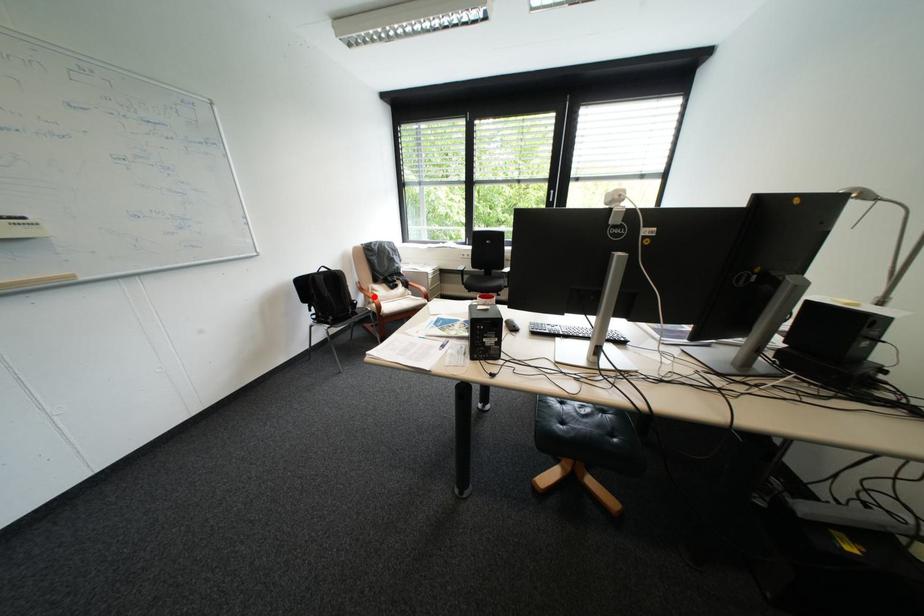
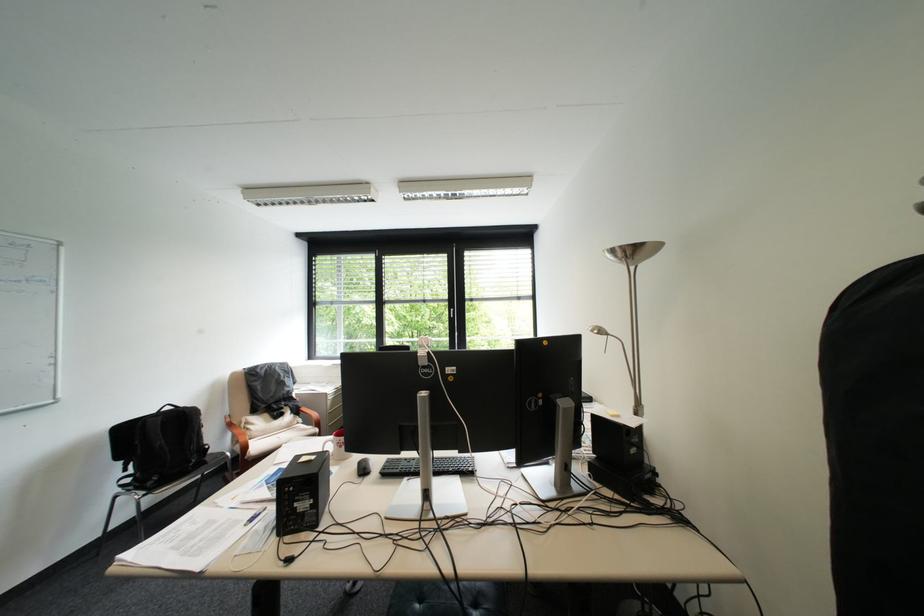
Question: I am providing you with two images of the same scene from different viewpoints. Given a red point in image1, look at the same physical point in image2. Is it:

Choices:
 (A) Closer to the viewpoint
 (B) Farther from the viewpoint

Answer: (B)